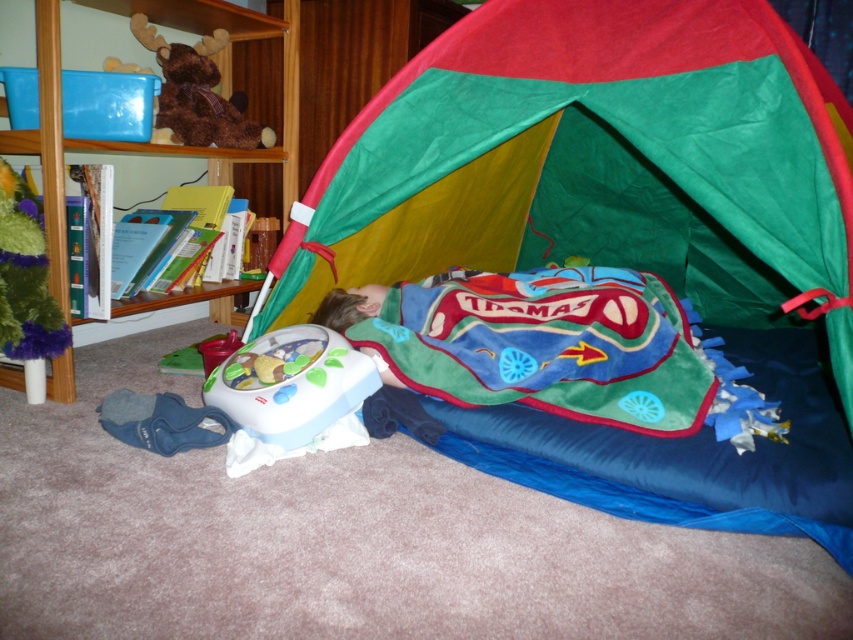
Question: Which object is closer to the camera taking this photo?

Choices:
 (A) wooden bookshelf at upper left
 (B) multicolored fabric tent at center
 (C) fuzzy green plush at upper left
 (D) thomas-patterned fleece blanket at center

Answer: (B)

Question: Which of the following is the closest to the observer?

Choices:
 (A) thomas-patterned fleece blanket at center
 (B) multicolored fabric tent at center
 (C) wooden bookshelf at upper left
 (D) fuzzy green plush at upper left

Answer: (B)

Question: Is multicolored fabric tent at center below thomas-patterned fleece blanket at center?

Choices:
 (A) yes
 (B) no

Answer: (B)

Question: Can you confirm if multicolored fabric tent at center is positioned above thomas-patterned fleece blanket at center?

Choices:
 (A) yes
 (B) no

Answer: (A)

Question: Is thomas-patterned fleece blanket at center below wooden bookshelf at upper left?

Choices:
 (A) yes
 (B) no

Answer: (A)

Question: Which of these objects is positioned closest to the thomas-patterned fleece blanket at center?

Choices:
 (A) multicolored fabric tent at center
 (B) brown plush bear at upper left
 (C) fuzzy green plush at upper left

Answer: (A)